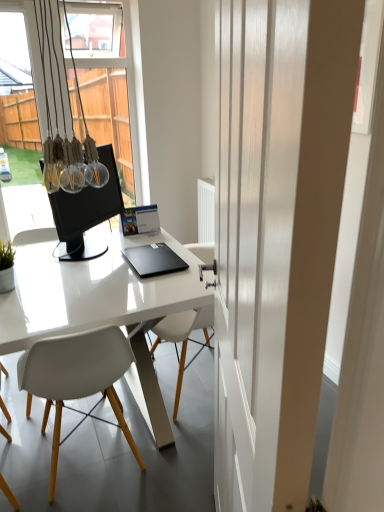
At what (x,y) coordinates should I click in order to perform the action: click on free space between black matte laptop at center and matte black monitor at center. Please return your answer as a coordinate pair (x, y). Image resolution: width=384 pixels, height=512 pixels. Looking at the image, I should click on (100, 263).